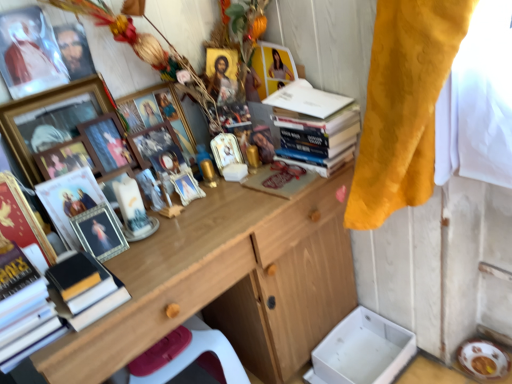
Question: From a real-world perspective, is matte gold picture frame at left, positioned as the 2th magazine in right-to-left order, on gold-framed picture at upper left, which is the 8th picture frame in right-to-left order?

Choices:
 (A) yes
 (B) no

Answer: (B)

Question: From a real-world perspective, is matte gold picture frame at left, the first magazine when ordered from left to right, located beneath gold-framed picture at upper left, which is the 8th picture frame in right-to-left order?

Choices:
 (A) no
 (B) yes

Answer: (B)

Question: Is the depth of matte gold picture frame at left, the first magazine when ordered from left to right, greater than that of gold-framed picture at upper left, the 2th picture frame in the left-to-right sequence?

Choices:
 (A) no
 (B) yes

Answer: (A)

Question: From the image's perspective, would you say matte gold picture frame at left, the first magazine when ordered from left to right, is shown under gold-framed picture at upper left, the 2th picture frame in the left-to-right sequence?

Choices:
 (A) no
 (B) yes

Answer: (B)

Question: Does matte gold picture frame at left, the first magazine when ordered from left to right, lie in front of gold-framed picture at upper left, which is the 8th picture frame in right-to-left order?

Choices:
 (A) no
 (B) yes

Answer: (B)

Question: Looking at their shapes, would you say wooden picture frame at center, the second picture frame in the right-to-left sequence, is wider or thinner than silver metallic picture frame at center-left, which is counted as the fifth picture frame, starting from the right?

Choices:
 (A) thin
 (B) wide

Answer: (B)

Question: Relative to silver metallic picture frame at center-left, which is counted as the fifth picture frame, starting from the right, is wooden picture frame at center, the second picture frame in the right-to-left sequence, in front or behind?

Choices:
 (A) front
 (B) behind

Answer: (B)

Question: From the image's perspective, is wooden picture frame at center, which is the eighth picture frame from left to right, located above or below silver metallic picture frame at center-left, the 5th picture frame when ordered from left to right?

Choices:
 (A) below
 (B) above

Answer: (B)

Question: Considering the positions of wooden picture frame at center, the second picture frame in the right-to-left sequence, and silver metallic picture frame at center-left, the 5th picture frame when ordered from left to right, in the image, is wooden picture frame at center, the second picture frame in the right-to-left sequence, bigger or smaller than silver metallic picture frame at center-left, the 5th picture frame when ordered from left to right,?

Choices:
 (A) small
 (B) big

Answer: (B)

Question: Would you say metallic gold picture frame at center, the first picture frame positioned from the right, is to the left or to the right of hardcover books at upper right, the 1th book viewed from the back, in the picture?

Choices:
 (A) left
 (B) right

Answer: (A)

Question: Is metallic gold picture frame at center, which is counted as the ninth picture frame, starting from the left, bigger or smaller than hardcover books at upper right, the second book viewed from the front?

Choices:
 (A) small
 (B) big

Answer: (A)

Question: Is metallic gold picture frame at center, the first picture frame positioned from the right, wider or thinner than hardcover books at upper right, the 1th book from the right?

Choices:
 (A) thin
 (B) wide

Answer: (A)

Question: In the image, is metallic gold picture frame at center, which is counted as the ninth picture frame, starting from the left, positioned in front of or behind hardcover books at upper right, acting as the second book starting from the left?

Choices:
 (A) behind
 (B) front

Answer: (A)

Question: Is matte black portrait at upper left in front of or behind wooden desk at center in the image?

Choices:
 (A) front
 (B) behind

Answer: (B)

Question: Looking at the image, does matte black portrait at upper left seem bigger or smaller compared to wooden desk at center?

Choices:
 (A) small
 (B) big

Answer: (A)